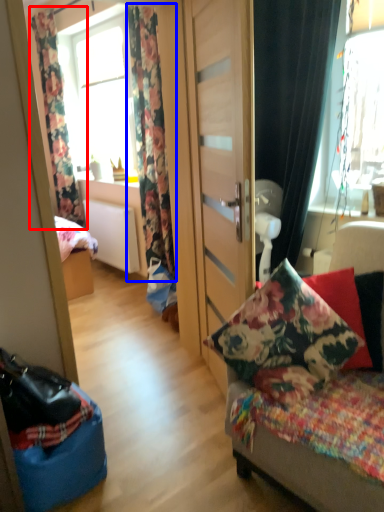
Question: Which object is closer to the camera taking this photo, curtain (highlighted by a red box) or curtain (highlighted by a blue box)?

Choices:
 (A) curtain
 (B) curtain

Answer: (B)